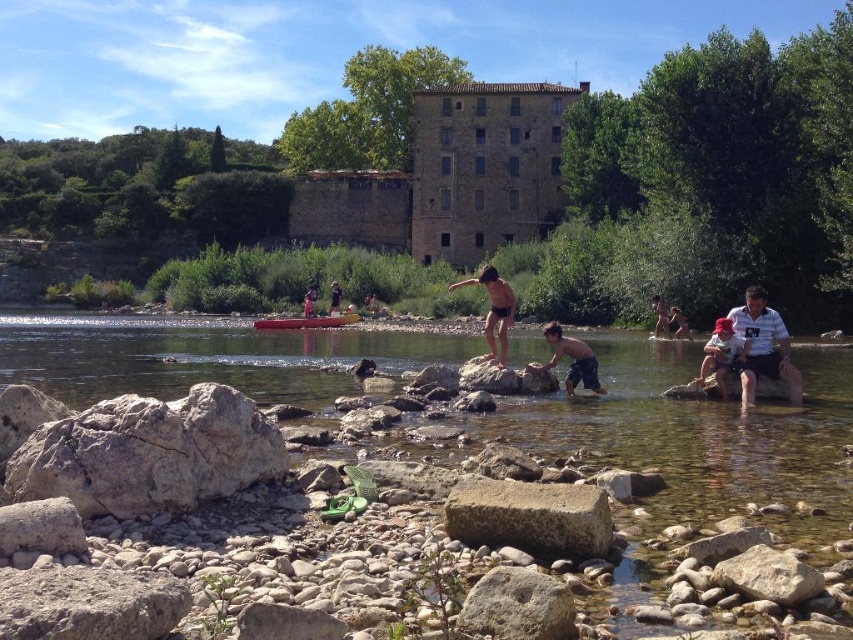
Can you confirm if smooth plastic boat at center is positioned above light brown wooden paddle at center?

Actually, smooth plastic boat at center is below light brown wooden paddle at center.

Which is in front, point (341, 323) or point (306, 292)?

Positioned in front is point (341, 323).

Locate an element on the screen. This screenshot has width=853, height=640. smooth plastic boat at center is located at coordinates (306, 321).

This screenshot has width=853, height=640. Describe the element at coordinates (763, 346) in the screenshot. I see `white striped shirt at right` at that location.

Does white striped shirt at right have a lesser height compared to shiny black shorts at center?

No, white striped shirt at right is not shorter than shiny black shorts at center.

Does point (757, 326) lie in front of point (558, 348)?

Yes, point (757, 326) is closer to viewer.

You are a GUI agent. You are given a task and a screenshot of the screen. Output one action in this format:
    pyautogui.click(x=<x>, y=<y>)
    Task: Click on the white striped shirt at right
    Image resolution: width=853 pixels, height=640 pixels.
    Given the screenshot: What is the action you would take?
    pyautogui.click(x=763, y=346)

Does dark blue shorts at right have a greater width compared to light brown wooden paddle at center?

Correct, the width of dark blue shorts at right exceeds that of light brown wooden paddle at center.

Is dark blue shorts at right below light brown wooden paddle at center?

Correct, dark blue shorts at right is located below light brown wooden paddle at center.

Who is more forward, (653, 328) or (310, 294)?

Point (653, 328)

Locate an element on the screen. Image resolution: width=853 pixels, height=640 pixels. dark blue shorts at right is located at coordinates (668, 320).